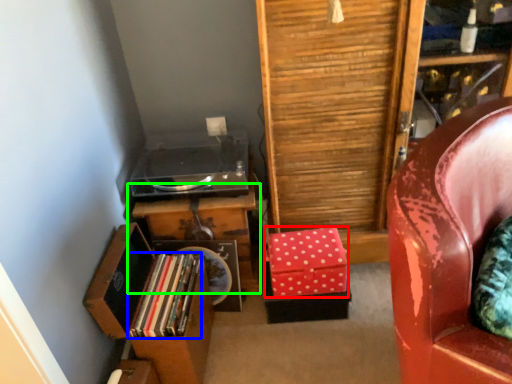
Question: Which object is positioned farthest from box (highlighted by a red box)? Select from book (highlighted by a blue box) and table (highlighted by a green box).

Choices:
 (A) book
 (B) table

Answer: (A)